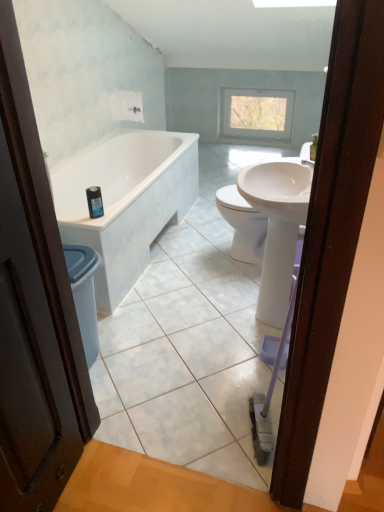
Question: Does clear glass window at upper center have a lesser width compared to white glossy sink at center?

Choices:
 (A) yes
 (B) no

Answer: (A)

Question: From the image's perspective, would you say clear glass window at upper center is positioned over white glossy sink at center?

Choices:
 (A) yes
 (B) no

Answer: (A)

Question: Is clear glass window at upper center bigger than white glossy sink at center?

Choices:
 (A) yes
 (B) no

Answer: (B)

Question: Is clear glass window at upper center to the right of white glossy sink at center from the viewer's perspective?

Choices:
 (A) no
 (B) yes

Answer: (B)

Question: Can you confirm if clear glass window at upper center is positioned to the left of white glossy sink at center?

Choices:
 (A) yes
 (B) no

Answer: (B)

Question: From a real-world perspective, does clear glass window at upper center stand above white glossy sink at center?

Choices:
 (A) no
 (B) yes

Answer: (A)

Question: Can you confirm if white glossy bathtub at left is positioned to the right of blue glossy bottle at upper left?

Choices:
 (A) yes
 (B) no

Answer: (B)

Question: Is white glossy bathtub at left positioned far away from blue glossy bottle at upper left?

Choices:
 (A) yes
 (B) no

Answer: (B)

Question: Is white glossy bathtub at left oriented towards blue glossy bottle at upper left?

Choices:
 (A) no
 (B) yes

Answer: (A)

Question: Can you confirm if white glossy bathtub at left is bigger than blue glossy bottle at upper left?

Choices:
 (A) no
 (B) yes

Answer: (B)

Question: Is white glossy bathtub at left with blue glossy bottle at upper left?

Choices:
 (A) no
 (B) yes

Answer: (A)

Question: Does white glossy bathtub at left have a smaller size compared to blue glossy bottle at upper left?

Choices:
 (A) yes
 (B) no

Answer: (B)

Question: From a real-world perspective, is white glossy bathtub at left on clear glass window at upper center?

Choices:
 (A) yes
 (B) no

Answer: (B)